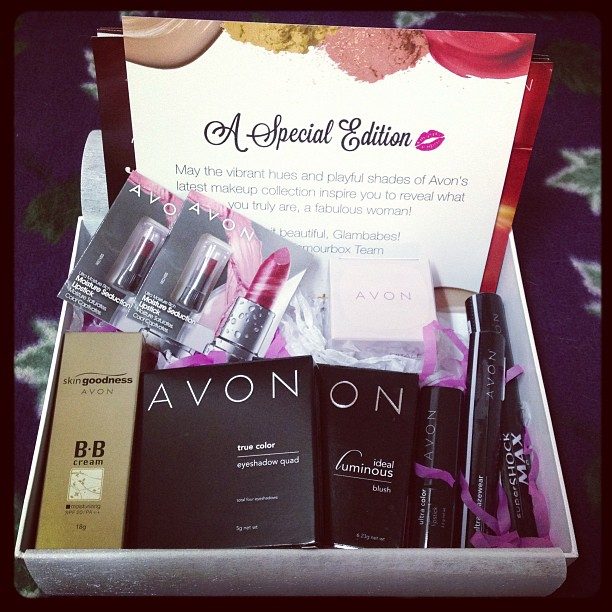
The height and width of the screenshot is (612, 612). What are the coordinates of `box` in the screenshot? It's located at (242, 579), (365, 428), (267, 424), (103, 398), (382, 305).